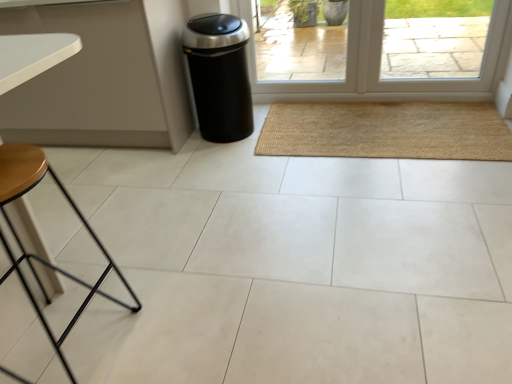
Identify the location of vacant area that is in front of black matte trash can at center-left. (236, 156).